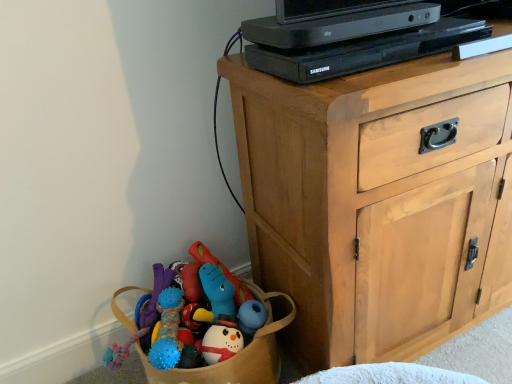
Question: Is light wood cabinet at upper right bigger than black plastic computer at upper center?

Choices:
 (A) no
 (B) yes

Answer: (B)

Question: Does light wood cabinet at upper right have a greater height compared to black plastic computer at upper center?

Choices:
 (A) no
 (B) yes

Answer: (B)

Question: Considering the relative sizes of light wood cabinet at upper right and black plastic computer at upper center in the image provided, is light wood cabinet at upper right shorter than black plastic computer at upper center?

Choices:
 (A) yes
 (B) no

Answer: (B)

Question: Is the depth of light wood cabinet at upper right greater than that of black plastic computer at upper center?

Choices:
 (A) no
 (B) yes

Answer: (A)

Question: Is light wood cabinet at upper right not inside black plastic computer at upper center?

Choices:
 (A) no
 (B) yes

Answer: (B)

Question: Is black plastic computer at upper center surrounded by light wood cabinet at upper right?

Choices:
 (A) no
 (B) yes

Answer: (A)

Question: Does black plastic computer at upper center have a lesser height compared to light wood cabinet at upper right?

Choices:
 (A) yes
 (B) no

Answer: (A)

Question: Is black plastic computer at upper center facing away from light wood cabinet at upper right?

Choices:
 (A) no
 (B) yes

Answer: (A)

Question: Is black plastic computer at upper center next to light wood cabinet at upper right and touching it?

Choices:
 (A) no
 (B) yes

Answer: (A)

Question: From the image's perspective, does black plastic computer at upper center appear lower than light wood cabinet at upper right?

Choices:
 (A) no
 (B) yes

Answer: (A)

Question: Is black plastic computer at upper center smaller than light wood cabinet at upper right?

Choices:
 (A) yes
 (B) no

Answer: (A)

Question: From a real-world perspective, is black plastic computer at upper center under light wood cabinet at upper right?

Choices:
 (A) no
 (B) yes

Answer: (A)

Question: Considering the positions of light wood cabinet at upper right and black plastic computer at upper center in the image, is light wood cabinet at upper right taller or shorter than black plastic computer at upper center?

Choices:
 (A) short
 (B) tall

Answer: (B)